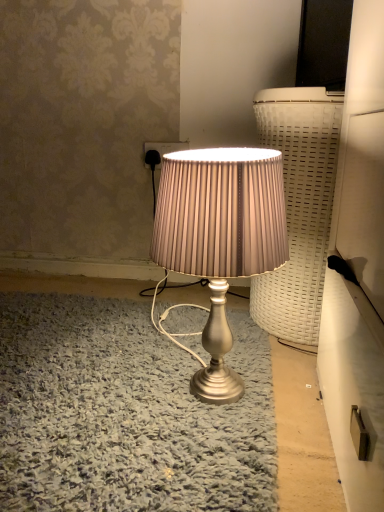
From the picture: What is the approximate width of matte black socket at upper center?

matte black socket at upper center is 1.67 centimeters wide.

Measure the distance between point (151, 143) and camera.

Point (151, 143) and camera are 4.56 feet apart from each other.

At what (x,y) coordinates should I click in order to perform the action: click on matte black socket at upper center. Please return your answer as a coordinate pair (x, y). This screenshot has height=512, width=384. Looking at the image, I should click on (165, 147).

This screenshot has width=384, height=512. Describe the element at coordinates (165, 147) in the screenshot. I see `matte black socket at upper center` at that location.

In order to face matte black socket at upper center, should I rotate leftwards or rightwards?

Turn left approximately 3.703 degrees to face it.

Locate an element on the screen. satin silver lamp at center is located at coordinates (220, 237).

What do you see at coordinates (220, 237) in the screenshot?
I see `satin silver lamp at center` at bounding box center [220, 237].

Locate an element on the screen. The height and width of the screenshot is (512, 384). matte black socket at upper center is located at coordinates (165, 147).

Which object is positioned more to the right, satin silver lamp at center or matte black socket at upper center?

satin silver lamp at center.

Is satin silver lamp at center behind matte black socket at upper center?

No.

Is point (199, 212) farther from viewer compared to point (164, 144)?

No, it is not.

From the image's perspective, would you say satin silver lamp at center is shown under matte black socket at upper center?

Yes, from the image's perspective, satin silver lamp at center is beneath matte black socket at upper center.

From a real-world perspective, which is physically above, satin silver lamp at center or matte black socket at upper center?

From a 3D spatial view, matte black socket at upper center is above.

Considering the sizes of satin silver lamp at center and matte black socket at upper center in the image, is satin silver lamp at center wider or thinner than matte black socket at upper center?

In the image, satin silver lamp at center appears to be wider than matte black socket at upper center.

Can you confirm if satin silver lamp at center is shorter than matte black socket at upper center?

No.

Does satin silver lamp at center have a smaller size compared to matte black socket at upper center?

No.

Is satin silver lamp at center inside or outside of matte black socket at upper center?

satin silver lamp at center cannot be found inside matte black socket at upper center.

Is satin silver lamp at center next to matte black socket at upper center and touching it?

satin silver lamp at center and matte black socket at upper center are not in contact.

Is satin silver lamp at center looking in the opposite direction of matte black socket at upper center?

No, satin silver lamp at center is not facing away from matte black socket at upper center.

How many degrees apart are the facing directions of satin silver lamp at center and matte black socket at upper center?

The angle between the facing direction of satin silver lamp at center and the facing direction of matte black socket at upper center is 91.4 degrees.

Where is `lamp below the matte black socket at upper center (from the image's perspective)`? The height and width of the screenshot is (512, 384). lamp below the matte black socket at upper center (from the image's perspective) is located at coordinates (220, 237).

Which object is positioned more to the left, matte black socket at upper center or satin silver lamp at center?

From the viewer's perspective, matte black socket at upper center appears more on the left side.

Is the position of matte black socket at upper center more distant than that of satin silver lamp at center?

Yes, matte black socket at upper center is further from the camera.

Does point (144, 148) lie behind point (253, 152)?

Yes, it is.

From the image's perspective, which object appears higher, matte black socket at upper center or satin silver lamp at center?

matte black socket at upper center appears higher in the image.

From a real-world perspective, is matte black socket at upper center positioned over satin silver lamp at center based on gravity?

Correct, in the physical world, matte black socket at upper center is higher than satin silver lamp at center.

Consider the image. Can you confirm if matte black socket at upper center is thinner than satin silver lamp at center?

Indeed, matte black socket at upper center has a lesser width compared to satin silver lamp at center.

Can you confirm if matte black socket at upper center is shorter than satin silver lamp at center?

Indeed, matte black socket at upper center has a lesser height compared to satin silver lamp at center.

Who is smaller, matte black socket at upper center or satin silver lamp at center?

matte black socket at upper center is smaller.

Is matte black socket at upper center surrounding satin silver lamp at center?

No, satin silver lamp at center is located outside of matte black socket at upper center.

Does matte black socket at upper center touch satin silver lamp at center?

No, matte black socket at upper center is not touching satin silver lamp at center.

Could you tell me if matte black socket at upper center is turned towards satin silver lamp at center?

Yes, matte black socket at upper center is aimed at satin silver lamp at center.

How distant is matte black socket at upper center from satin silver lamp at center?

A distance of 21.65 inches exists between matte black socket at upper center and satin silver lamp at center.

Image resolution: width=384 pixels, height=512 pixels. Identify the location of electric outlet above the satin silver lamp at center (from a real-world perspective). (165, 147).

Find the location of a particular element. The width and height of the screenshot is (384, 512). lamp that appears below the matte black socket at upper center (from a real-world perspective) is located at coordinates (220, 237).

The height and width of the screenshot is (512, 384). Find the location of `electric outlet above the satin silver lamp at center (from a real-world perspective)`. electric outlet above the satin silver lamp at center (from a real-world perspective) is located at coordinates (165, 147).